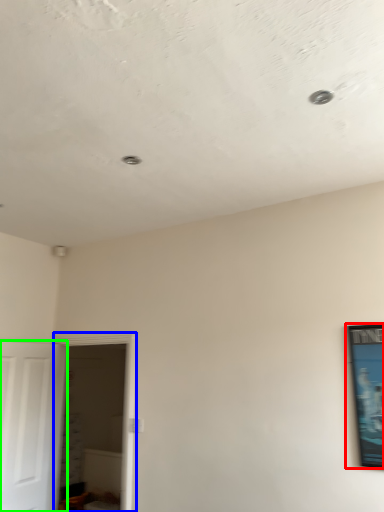
Question: Which is nearer to the picture frame (highlighted by a red box)? glass door (highlighted by a blue box) or door (highlighted by a green box).

Choices:
 (A) glass door
 (B) door

Answer: (A)